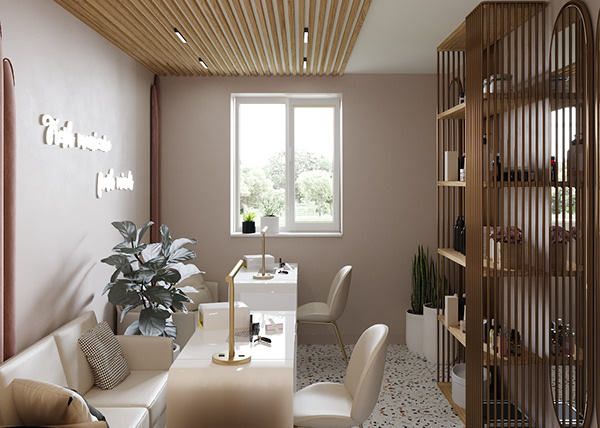
Where is `full length mirror`? full length mirror is located at coordinates (568, 140), (453, 130).